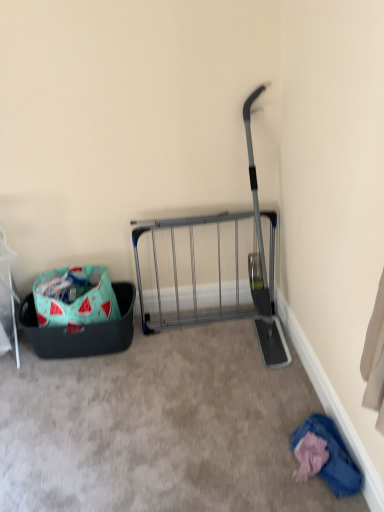
This screenshot has height=512, width=384. Identify the location of watermelon-patterned fabric bag at lower left. coord(75,297).

Locate an element on the screen. This screenshot has height=512, width=384. metallic gray rack at center is located at coordinates (191, 271).

Is blue cotton shirt at lower right oriented away from metallic gray rack at center?

No, blue cotton shirt at lower right is not facing away from metallic gray rack at center.

Considering the sizes of blue cotton shirt at lower right and metallic gray rack at center in the image, is blue cotton shirt at lower right bigger or smaller than metallic gray rack at center?

blue cotton shirt at lower right is smaller than metallic gray rack at center.

Is metallic gray rack at center located within blue cotton shirt at lower right?

No, blue cotton shirt at lower right does not contain metallic gray rack at center.

Is teal fabric laundry basket at lower left inside blue cotton shirt at lower right?

No, teal fabric laundry basket at lower left is located outside of blue cotton shirt at lower right.

Is blue cotton shirt at lower right bigger or smaller than teal fabric laundry basket at lower left?

blue cotton shirt at lower right is smaller than teal fabric laundry basket at lower left.

Is blue cotton shirt at lower right turned away from teal fabric laundry basket at lower left?

blue cotton shirt at lower right is not turned away from teal fabric laundry basket at lower left.

From the image's perspective, is blue cotton shirt at lower right located above teal fabric laundry basket at lower left?

Actually, blue cotton shirt at lower right appears below teal fabric laundry basket at lower left in the image.

Can you confirm if blue cotton shirt at lower right is taller than watermelon-patterned fabric bag at lower left?

No.

Is watermelon-patterned fabric bag at lower left a part of blue cotton shirt at lower right?

No.

In the scene shown: Is blue cotton shirt at lower right bigger or smaller than watermelon-patterned fabric bag at lower left?

In the image, blue cotton shirt at lower right appears to be smaller than watermelon-patterned fabric bag at lower left.

Is watermelon-patterned fabric bag at lower left not near teal fabric laundry basket at lower left?

No, watermelon-patterned fabric bag at lower left is not far away from teal fabric laundry basket at lower left.

Does point (106, 312) come behind point (26, 322)?

That is False.

From the image's perspective, which one is positioned lower, watermelon-patterned fabric bag at lower left or teal fabric laundry basket at lower left?

teal fabric laundry basket at lower left.

Looking at this image, is watermelon-patterned fabric bag at lower left facing away from teal fabric laundry basket at lower left?

No, watermelon-patterned fabric bag at lower left is not facing away from teal fabric laundry basket at lower left.

Is teal fabric laundry basket at lower left completely or partially outside of blue cotton shirt at lower right?

Yes, teal fabric laundry basket at lower left is not within blue cotton shirt at lower right.

Is teal fabric laundry basket at lower left positioned with its back to blue cotton shirt at lower right?

No, teal fabric laundry basket at lower left's orientation is not away from blue cotton shirt at lower right.

Considering the sizes of objects teal fabric laundry basket at lower left and blue cotton shirt at lower right in the image provided, who is taller, teal fabric laundry basket at lower left or blue cotton shirt at lower right?

Standing taller between the two is teal fabric laundry basket at lower left.

From a real-world perspective, relative to watermelon-patterned fabric bag at lower left, is teal fabric laundry basket at lower left vertically above or below?

In terms of real-world spatial position, teal fabric laundry basket at lower left is below watermelon-patterned fabric bag at lower left.

Considering the relative sizes of teal fabric laundry basket at lower left and watermelon-patterned fabric bag at lower left in the image provided, is teal fabric laundry basket at lower left smaller than watermelon-patterned fabric bag at lower left?

Incorrect, teal fabric laundry basket at lower left is not smaller in size than watermelon-patterned fabric bag at lower left.

Between point (26, 311) and point (95, 273), which one is positioned behind?

The point (95, 273) is more distant.

Is metallic gray rack at center at the back of teal fabric laundry basket at lower left?

No, teal fabric laundry basket at lower left's orientation is not away from metallic gray rack at center.

Is point (132, 298) closer or farther from the camera than point (270, 213)?

Point (132, 298) appears to be farther away from the viewer than point (270, 213).

In the scene shown: Is teal fabric laundry basket at lower left taller than metallic gray rack at center?

No.

Considering the positions of objects teal fabric laundry basket at lower left and metallic gray rack at center in the image provided, who is more to the right, teal fabric laundry basket at lower left or metallic gray rack at center?

metallic gray rack at center.

Image resolution: width=384 pixels, height=512 pixels. What are the coordinates of `cart behind the blue cotton shirt at lower right` in the screenshot? It's located at (191, 271).

In order to click on clothing below the teal fabric laundry basket at lower left (from the image's perspective) in this screenshot , I will do `click(332, 455)`.

Estimate the real-world distances between objects in this image. Which object is closer to teal fabric laundry basket at lower left, watermelon-patterned fabric bag at lower left or blue cotton shirt at lower right?

watermelon-patterned fabric bag at lower left is closer to teal fabric laundry basket at lower left.

Based on their spatial positions, is blue cotton shirt at lower right or watermelon-patterned fabric bag at lower left closer to metallic gray rack at center?

watermelon-patterned fabric bag at lower left is positioned closer to the anchor metallic gray rack at center.

Looking at the image, which one is located further to teal fabric laundry basket at lower left, metallic gray rack at center or blue cotton shirt at lower right?

blue cotton shirt at lower right lies further to teal fabric laundry basket at lower left than the other object.

Estimate the real-world distances between objects in this image. Which object is further from watermelon-patterned fabric bag at lower left, blue cotton shirt at lower right or teal fabric laundry basket at lower left?

Among the two, blue cotton shirt at lower right is located further to watermelon-patterned fabric bag at lower left.

Which object lies further to the anchor point blue cotton shirt at lower right, metallic gray rack at center or teal fabric laundry basket at lower left?

teal fabric laundry basket at lower left lies further to blue cotton shirt at lower right than the other object.

Which object lies further to the anchor point watermelon-patterned fabric bag at lower left, metallic gray rack at center or teal fabric laundry basket at lower left?

metallic gray rack at center lies further to watermelon-patterned fabric bag at lower left than the other object.

When comparing their distances from metallic gray rack at center, does watermelon-patterned fabric bag at lower left or teal fabric laundry basket at lower left seem further?

watermelon-patterned fabric bag at lower left is positioned further to the anchor metallic gray rack at center.

Which object lies nearer to the anchor point watermelon-patterned fabric bag at lower left, metallic gray rack at center or blue cotton shirt at lower right?

metallic gray rack at center is positioned closer to the anchor watermelon-patterned fabric bag at lower left.

Image resolution: width=384 pixels, height=512 pixels. I want to click on cart between teal fabric laundry basket at lower left and blue cotton shirt at lower right from left to right, so click(x=191, y=271).

Identify the location of cart between watermelon-patterned fabric bag at lower left and blue cotton shirt at lower right from left to right. (191, 271).

The image size is (384, 512). I want to click on laundry basket between watermelon-patterned fabric bag at lower left and metallic gray rack at center, so click(x=83, y=330).

Identify the location of laundry basket situated between watermelon-patterned fabric bag at lower left and blue cotton shirt at lower right from left to right. The height and width of the screenshot is (512, 384). coord(83,330).